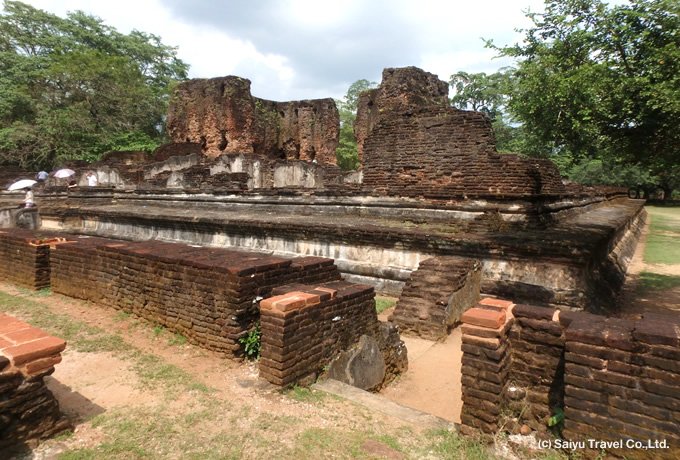
At what (x,y) coordinates should I click in order to perform the action: click on plinth. Please return your answer as a coordinate pair (x, y). Looking at the image, I should click on (375, 261).